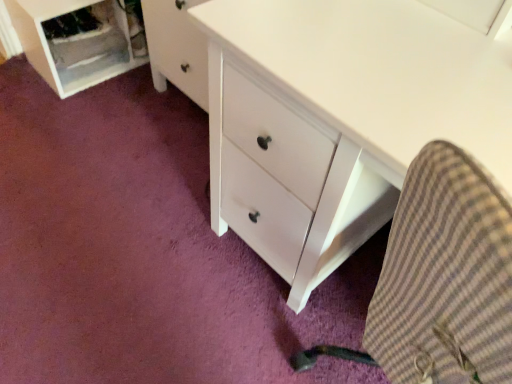
At what (x,y) coordinates should I click in order to perform the action: click on free space to the left of white plastic file cabinet at lower left. Please return your answer as a coordinate pair (x, y). Looking at the image, I should click on (24, 81).